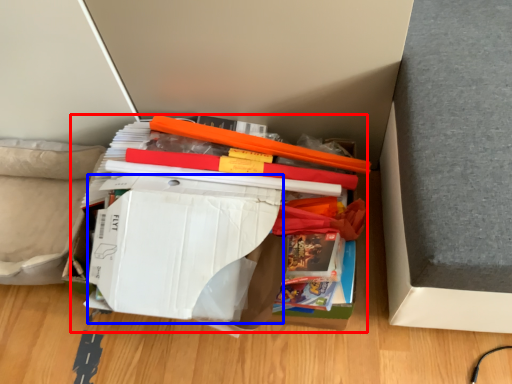
Question: Which object is closer to the camera taking this photo, paperback book (highlighted by a red box) or paperback book (highlighted by a blue box)?

Choices:
 (A) paperback book
 (B) paperback book

Answer: (B)